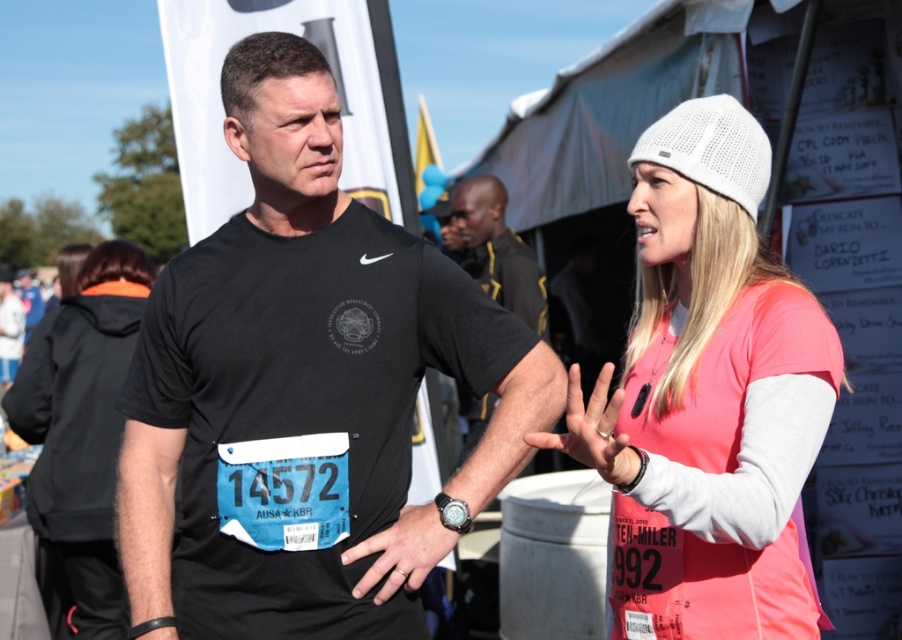
Between point (725, 148) and point (385, 536), which one is positioned behind?

The point (385, 536) is behind.

Can you confirm if pink fabric beanie at upper right is wider than black leather watch at center?

Yes.

Between point (802, 600) and point (424, 552), which one is positioned in front?

Point (802, 600)

Locate an element on the screen. The width and height of the screenshot is (902, 640). pink fabric beanie at upper right is located at coordinates (707, 397).

Can you confirm if black matte shirt at center is shorter than black leather watch at center?

Incorrect, black matte shirt at center's height does not fall short of black leather watch at center's.

Does black matte shirt at center have a greater height compared to black leather watch at center?

Yes.

Is point (542, 330) more distant than point (397, 584)?

That is True.

The height and width of the screenshot is (640, 902). I want to click on black matte shirt at center, so click(496, 250).

Can you confirm if black fleece jacket at left is taller than black matte shirt at center?

Indeed, black fleece jacket at left has a greater height compared to black matte shirt at center.

The width and height of the screenshot is (902, 640). Describe the element at coordinates (81, 429) in the screenshot. I see `black fleece jacket at left` at that location.

Locate an element on the screen. The width and height of the screenshot is (902, 640). black fleece jacket at left is located at coordinates (81, 429).